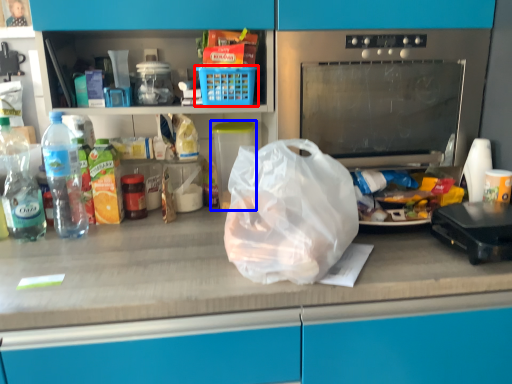
Question: Which object is further to the camera taking this photo, basket (highlighted by a red box) or appliance (highlighted by a blue box)?

Choices:
 (A) basket
 (B) appliance

Answer: (B)